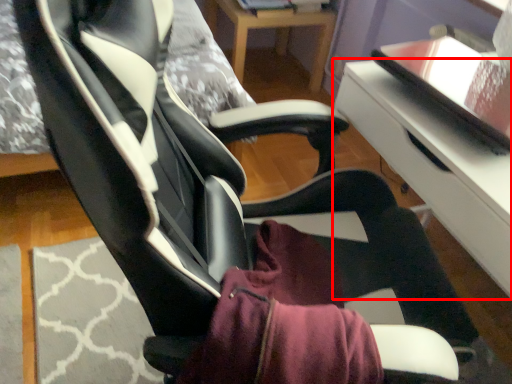
Question: From the image's perspective, what is the correct spatial positioning of table (annotated by the red box) in reference to table?

Choices:
 (A) above
 (B) below

Answer: (B)